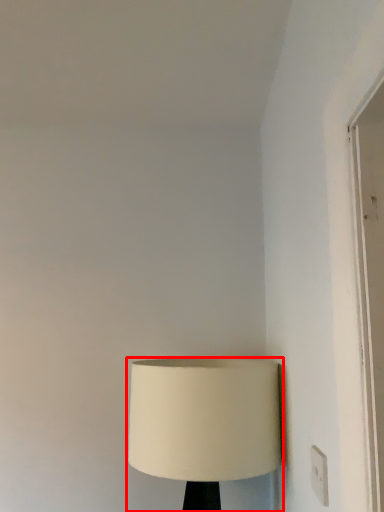
Question: In this image, where is lamp (annotated by the red box) located relative to electric outlet?

Choices:
 (A) right
 (B) left

Answer: (B)